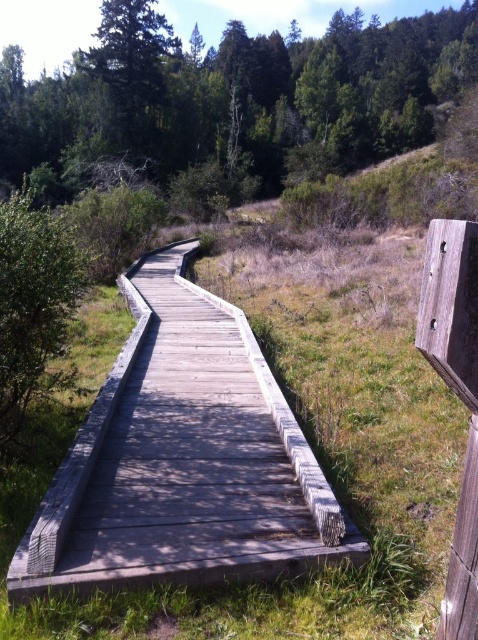
Question: Is gray wooden boardwalk at center positioned before green leafy bush at left?

Choices:
 (A) no
 (B) yes

Answer: (B)

Question: Can you confirm if gray wooden boardwalk at center is positioned above green leafy bush at left?

Choices:
 (A) yes
 (B) no

Answer: (B)

Question: Which object is farther from the camera taking this photo?

Choices:
 (A) green leafy tree at upper center
 (B) gray wooden boardwalk at center
 (C) green leafy bush at left

Answer: (A)

Question: Can you confirm if gray wooden boardwalk at center is wider than green leafy tree at upper center?

Choices:
 (A) no
 (B) yes

Answer: (A)

Question: Which point is closer to the camera?

Choices:
 (A) green leafy tree at upper center
 (B) gray wooden boardwalk at center
 (C) green leafy bush at left

Answer: (B)

Question: Among these objects, which one is farthest from the camera?

Choices:
 (A) gray wooden boardwalk at center
 (B) green leafy bush at left
 (C) green leafy tree at upper center

Answer: (C)